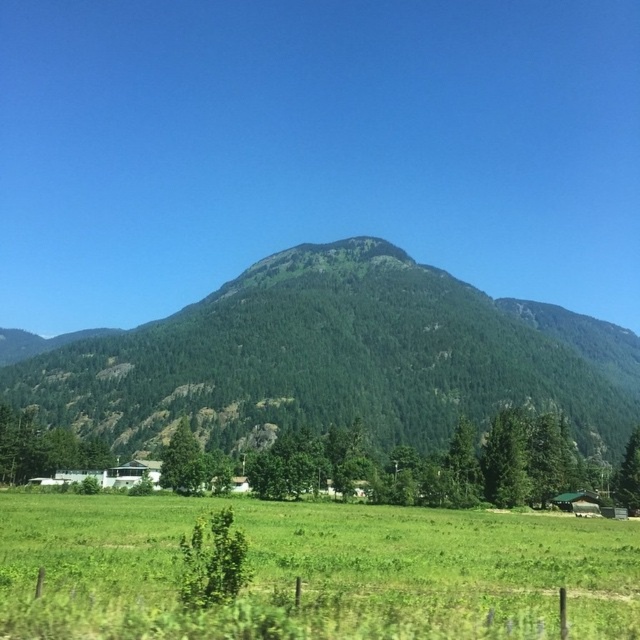
You are standing at the center of the image and want to walk towards the green leafy tree at lower left. Which direction should you head?

The green leafy tree at lower left is located at coordinates point (42, 448), so you should head towards the lower left direction to reach it.

You are a hiker planning to set up a tent in the grassland between the green leafy tree at lower left and the green matte tree at lower right. Which tree has a wider canopy to provide more shade?

The green leafy tree at lower left has a wider canopy than the green matte tree at lower right, so it provides more shade.

You are standing at the lower center of the image and want to walk towards the green matte tree at lower right. Which direction should you move relative to the green grass at lower center?

You should move to the right relative to the green grass at lower center to reach the green matte tree at lower right, since the green grass at lower center is positioned to the left of the green matte tree at lower right.